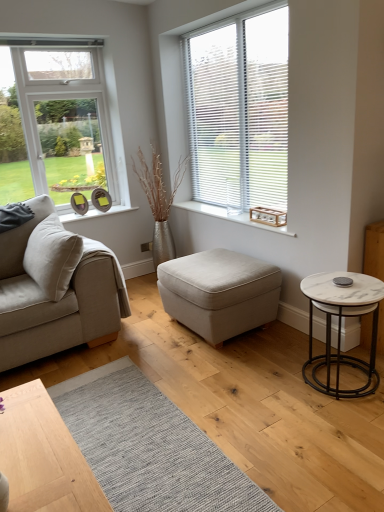
The height and width of the screenshot is (512, 384). Find the location of `spots to the right of beige fabric couch at left`. spots to the right of beige fabric couch at left is located at coordinates (149, 346).